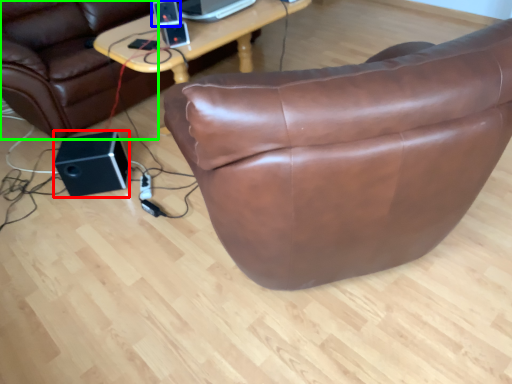
Question: Considering the real-world distances, which object is farthest from speaker (highlighted by a red box)? speaker (highlighted by a blue box) or bean bag chair (highlighted by a green box)?

Choices:
 (A) speaker
 (B) bean bag chair

Answer: (A)